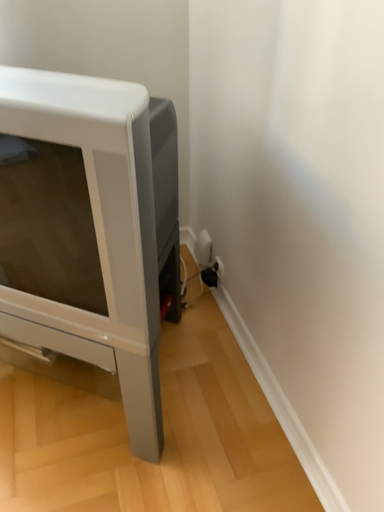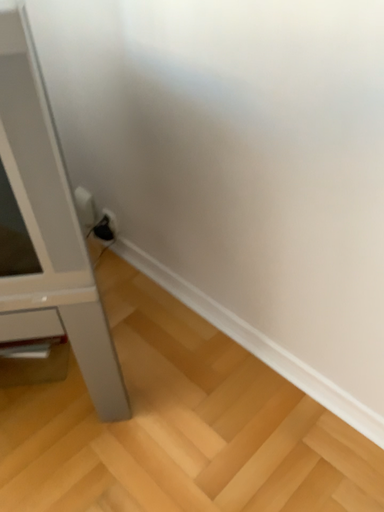
Question: Which way did the camera rotate in the video?

Choices:
 (A) rotated right
 (B) rotated left

Answer: (A)